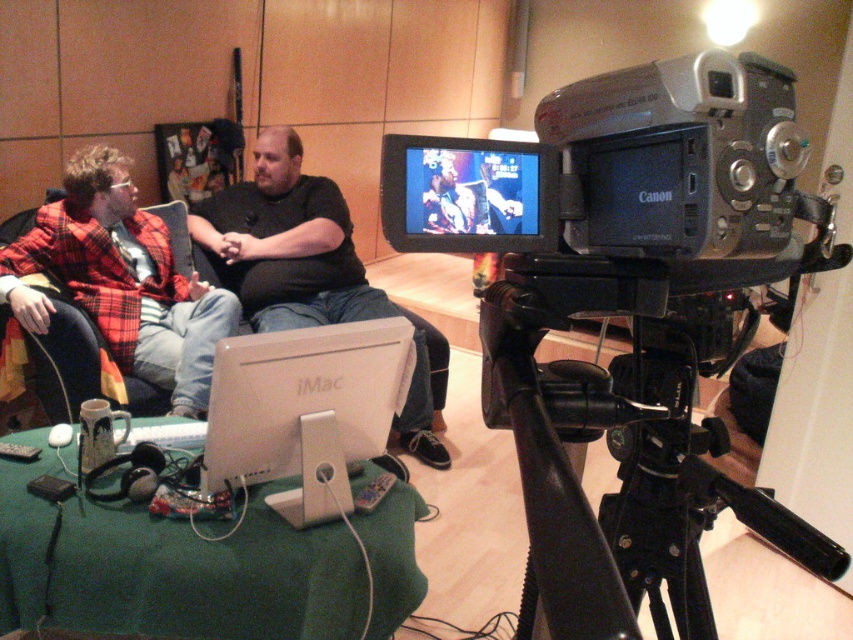
Question: Based on their relative distances, which object is farther from the white glossy imac at center?

Choices:
 (A) silver/black plastic video camera at center
 (B) black matte shirt at center
 (C) black plastic tripod at lower right

Answer: (B)

Question: Which of the following is the closest to the observer?

Choices:
 (A) (248, 408)
 (B) (337, 260)

Answer: (A)

Question: Does black plastic tripod at lower right appear over plaid fabric jacket at left?

Choices:
 (A) no
 (B) yes

Answer: (A)

Question: Observing the image, what is the correct spatial positioning of black plastic tripod at lower right in reference to white glossy imac at center?

Choices:
 (A) right
 (B) left

Answer: (A)

Question: Is silver/black plastic video camera at center to the left of black matte shirt at center from the viewer's perspective?

Choices:
 (A) no
 (B) yes

Answer: (A)

Question: Which point is farther from the camera taking this photo?

Choices:
 (A) (239, 417)
 (B) (125, 321)
 (C) (715, 358)

Answer: (B)